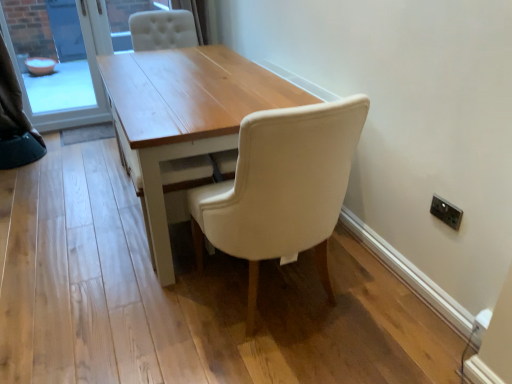
Question: Is matte glass bowl at left inside the boundaries of white fabric curtain at upper left, or outside?

Choices:
 (A) outside
 (B) inside

Answer: (A)

Question: Visually, is matte glass bowl at left positioned to the left or to the right of white fabric curtain at upper left?

Choices:
 (A) left
 (B) right

Answer: (B)

Question: Which object is the closest to the light wood table at center?

Choices:
 (A) matte white chair at center
 (B) matte glass bowl at left
 (C) white fabric curtain at upper left

Answer: (A)

Question: Based on their relative distances, which object is nearer to the matte glass bowl at left?

Choices:
 (A) white fabric curtain at upper left
 (B) matte white chair at center
 (C) light wood table at center

Answer: (A)